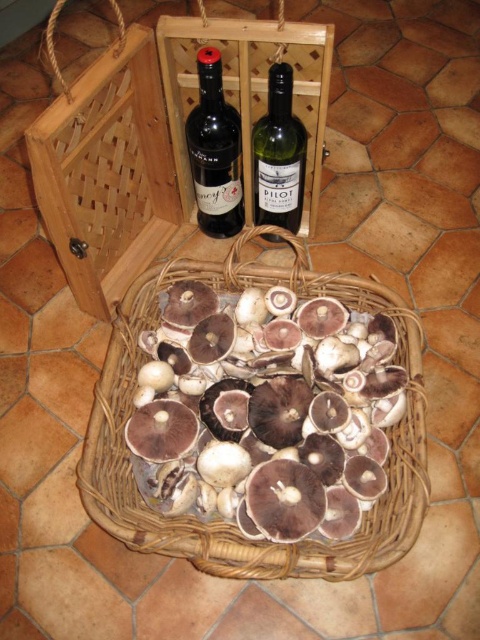
You are standing in front of the image and want to determine which of the two points, point (x=210, y=131) or point (x=278, y=83), is closer to you. Based on the spatial relationship between them, which point is nearer?

Point (x=210, y=131) is further to the camera than point (x=278, y=83), so the point closer to you is point (x=278, y=83).

You are arranging items on a shelf and need to place the woven brown basket at center and the green glass bottle at upper center. According to the scene, which item should be placed to the right side of the shelf to maintain the original spatial relationship?

The green glass bottle at upper center should be placed to the right side of the shelf because in the scene, the woven brown basket at center is to the left of the green glass bottle at upper center, meaning the bottle is originally positioned to the right of the basket.